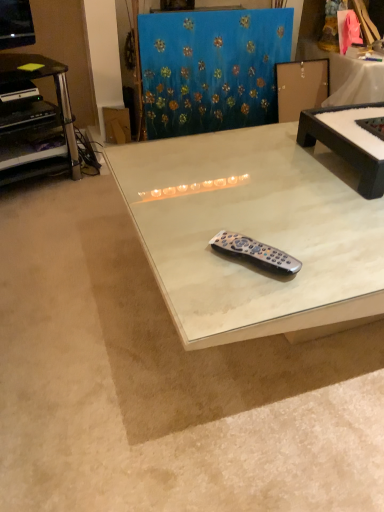
Question: Does cardboard at upper left appear on the right side of white marble table at center, the second table from the right?

Choices:
 (A) yes
 (B) no

Answer: (B)

Question: Is the position of cardboard at upper left more distant than that of white marble table at center, the second table from the right?

Choices:
 (A) no
 (B) yes

Answer: (B)

Question: Could you tell me if cardboard at upper left is turned towards white marble table at center, the second table from the right?

Choices:
 (A) yes
 (B) no

Answer: (A)

Question: Is cardboard at upper left facing away from white marble table at center, the 1th table positioned from the left?

Choices:
 (A) no
 (B) yes

Answer: (A)

Question: From a real-world perspective, is cardboard at upper left positioned under white marble table at center, the second table from the right, based on gravity?

Choices:
 (A) no
 (B) yes

Answer: (B)

Question: From the image's perspective, is cardboard at upper left below white marble table at center, the second table from the right?

Choices:
 (A) no
 (B) yes

Answer: (A)

Question: From a real-world perspective, is black matte table at center, the 2th table from the left, located higher than black plastic remote at center?

Choices:
 (A) no
 (B) yes

Answer: (B)

Question: Is black matte table at center, the 1th table in the right-to-left sequence, turned away from black plastic remote at center?

Choices:
 (A) no
 (B) yes

Answer: (A)

Question: Is black matte table at center, the 1th table in the right-to-left sequence, aimed at black plastic remote at center?

Choices:
 (A) yes
 (B) no

Answer: (B)

Question: Can you confirm if black matte table at center, the 1th table in the right-to-left sequence, is wider than black plastic remote at center?

Choices:
 (A) no
 (B) yes

Answer: (B)

Question: Considering the relative positions of black matte table at center, the 2th table from the left, and black plastic remote at center in the image provided, is black matte table at center, the 2th table from the left, to the left of black plastic remote at center from the viewer's perspective?

Choices:
 (A) yes
 (B) no

Answer: (B)

Question: Is black matte table at center, the 2th table from the left, shorter than black plastic remote at center?

Choices:
 (A) yes
 (B) no

Answer: (B)

Question: Can you confirm if black plastic desk at left is shorter than blue textured fabric at upper center?

Choices:
 (A) no
 (B) yes

Answer: (B)